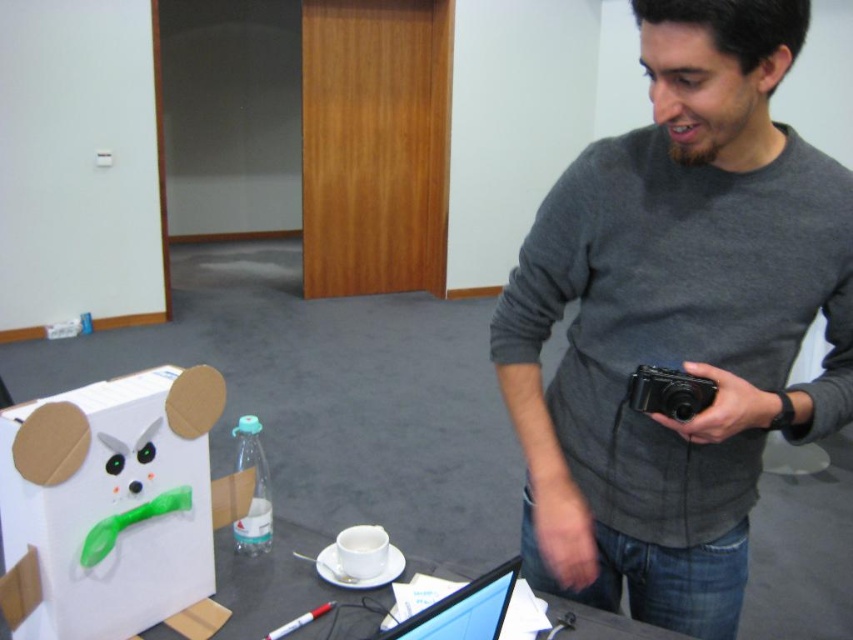
Question: Does black glossy laptop at center have a greater width compared to black plastic camera at center right?

Choices:
 (A) no
 (B) yes

Answer: (B)

Question: Is white cardboard box at lower left below black glossy laptop at center?

Choices:
 (A) no
 (B) yes

Answer: (A)

Question: Among these objects, which one is farthest from the camera?

Choices:
 (A) gray matte sweater at center
 (B) black plastic camera at center right
 (C) black glossy laptop at center
 (D) white cardboard box at lower left

Answer: (B)

Question: Which object is farther from the camera taking this photo?

Choices:
 (A) black glossy laptop at center
 (B) white cardboard box at lower left

Answer: (B)

Question: Does gray matte sweater at center have a greater width compared to black plastic camera at center right?

Choices:
 (A) yes
 (B) no

Answer: (A)

Question: Which is farther from the black glossy laptop at center?

Choices:
 (A) white cardboard box at lower left
 (B) black plastic camera at center right

Answer: (A)